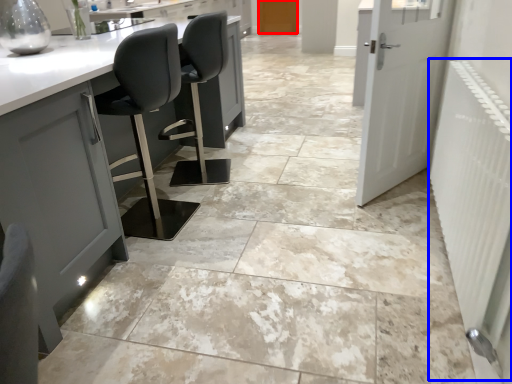
Question: Among these objects, which one is nearest to the camera, door (highlighted by a red box) or radiator (highlighted by a blue box)?

Choices:
 (A) door
 (B) radiator

Answer: (B)